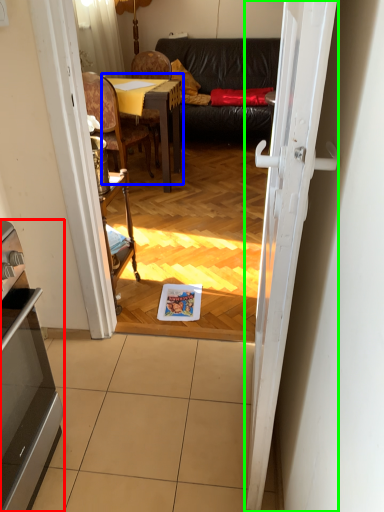
Question: Which object is positioned farthest from appliance (highlighted by a red box)? Select from table (highlighted by a blue box) and door (highlighted by a green box).

Choices:
 (A) table
 (B) door

Answer: (A)